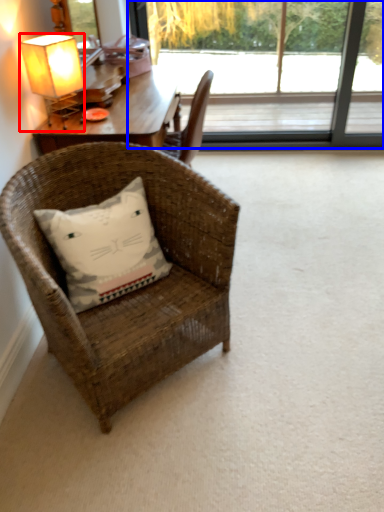
Question: Which of the following is the farthest to the observer, lamp (highlighted by a red box) or window (highlighted by a blue box)?

Choices:
 (A) lamp
 (B) window

Answer: (B)